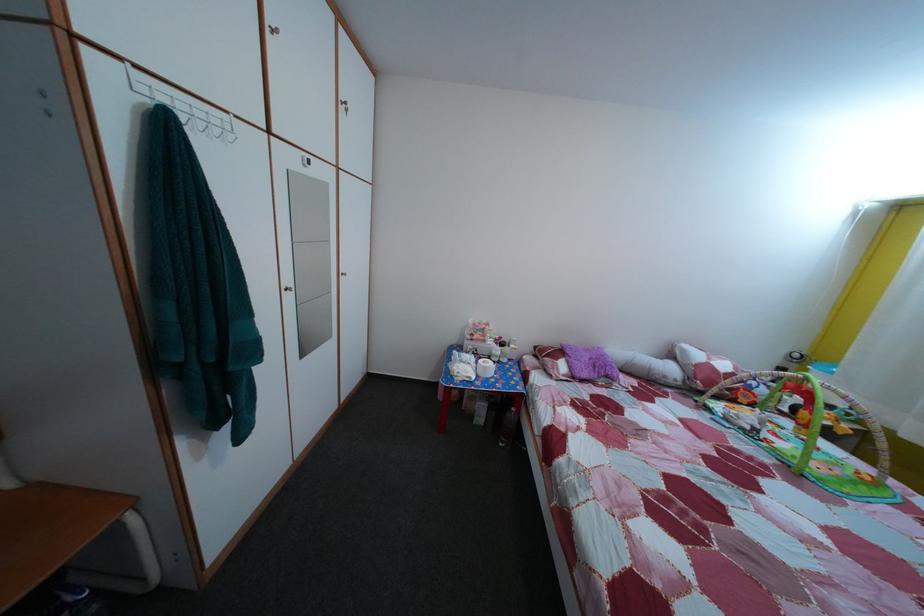
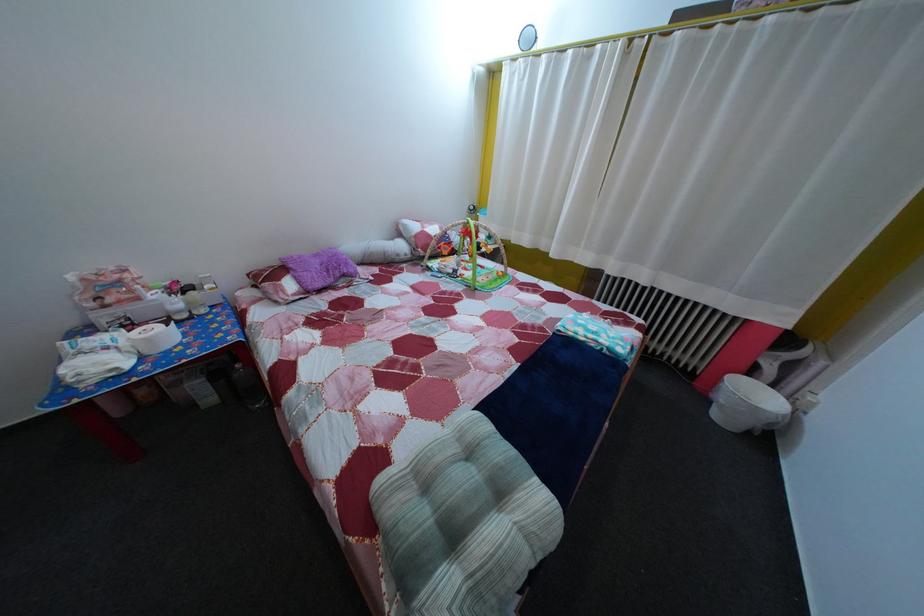
Find the pixel in the second image that matches (757,435) in the first image.

(459, 278)